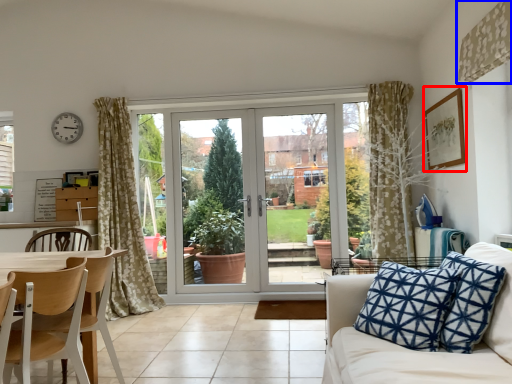
Question: Which object is further to the camera taking this photo, picture frame (highlighted by a red box) or curtain (highlighted by a blue box)?

Choices:
 (A) picture frame
 (B) curtain

Answer: (A)